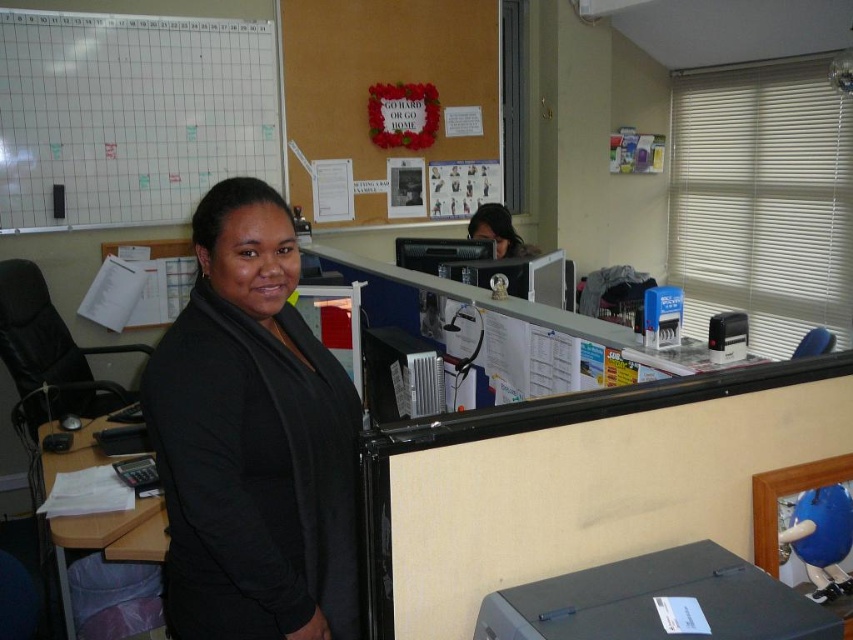
Find the location of a particular element. The image size is (853, 640). white grid paper at upper left is located at coordinates (129, 115).

Locate an element on the screen. white grid paper at upper left is located at coordinates (129, 115).

Does black matte printer at lower right have a smaller size compared to matte black hair at upper center?

Indeed, black matte printer at lower right has a smaller size compared to matte black hair at upper center.

Can you confirm if black matte printer at lower right is wider than matte black hair at upper center?

Indeed, black matte printer at lower right has a greater width compared to matte black hair at upper center.

Between point (480, 630) and point (509, 250), which one is positioned behind?

The point (509, 250) is more distant.

At what (x,y) coordinates should I click in order to perform the action: click on black matte printer at lower right. Please return your answer as a coordinate pair (x, y). Looking at the image, I should click on (654, 604).

Who is more distant from viewer, (346, 404) or (413, 340)?

Positioned behind is point (413, 340).

Looking at this image, measure the distance between point (289, 349) and camera.

Point (289, 349) is 1.35 meters from camera.

Is point (154, 410) less distant than point (378, 385)?

Yes.

The image size is (853, 640). What are the coordinates of `black matte jacket at center` in the screenshot? It's located at (252, 440).